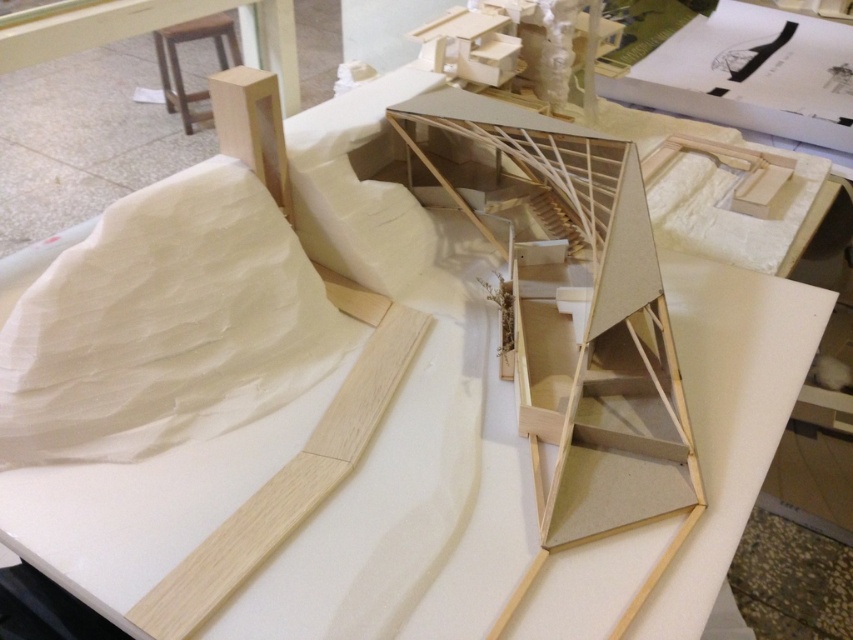
Based on the photo, you are an architect examining the model. You need to place a small scale model of a tree between the white paper at upper left and the natural wood plank at lower left. Can you position it so that it is between them without overlapping either?

Yes, since the white paper at upper left is located above the natural wood plank at lower left, you can position the tree between them vertically so that it is below the white paper at upper left and above the natural wood plank at lower left.

You are a model architect trying to place a 6 inch long decorative stone between the white paper at upper left and the natural wood plank at lower left in the architectural model. Can the stone fit in the space between them without overlapping either object?

The distance between the white paper at upper left and the natural wood plank at lower left is 7.63 inches. Since the decorative stone is only 6 inches long, there is enough space for it to fit between them without overlapping either object.